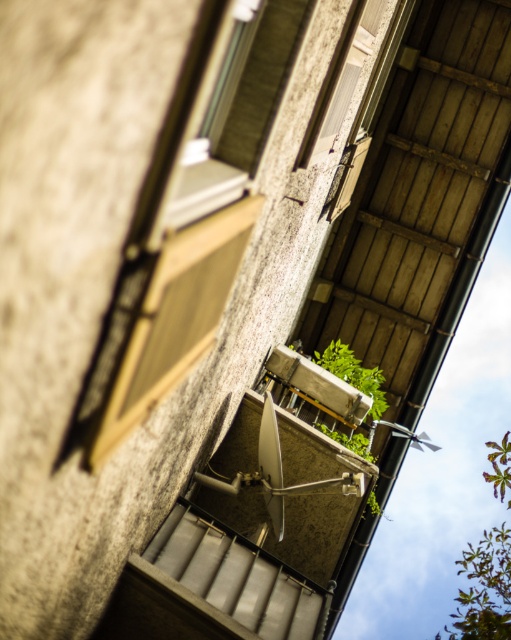
You are standing on the balcony and want to place a small potted plant between the wooden window frame at upper center and the green leafy plant at center. Is there enough space between them to fit the potted plant?

The wooden window frame at upper center is positioned on the left side of green leafy plant at center, so there is space between them to place the potted plant.

You are a window cleaner who needs to reach both the green leafy plant at lower right and the wooden window frame at upper center. Which object is smaller and requires less effort to clean?

The wooden window frame at upper center is smaller than the green leafy plant at lower right, so it requires less effort to clean.

You are a delivery drone that needs to land on the balcony. The landing area must be clear of any objects within a 10 meter radius. Are you able to land safely between the green leafy plant at lower right and the wooden window frame at upper center?

The green leafy plant at lower right is 9.13 meters from the wooden window frame at upper center. Since 9.13 meters is less than 10 meters, the distance between them is within the required radius. Therefore, the landing area is not clear enough, and you cannot land safely between them.